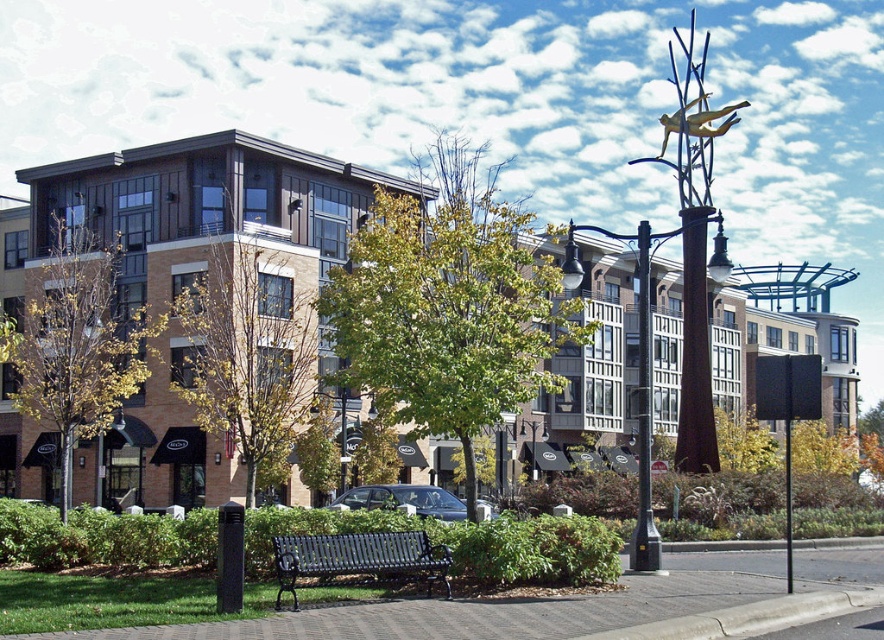
You are standing at the entrance of the building and want to sit on the black metal bench. Which direction should you walk relative to the bronze textured pole at center to reach the bench?

The bronze textured pole at center is located at point (682, 358), so you should walk towards the direction opposite to the bronze textured pole to reach the bench.

You are standing in the urban scene and want to sit on the black metal bench at center. If you face the bronze textured pole at center, which direction should you turn to approach the bench?

The bronze textured pole at center is to the right of the black metal bench at center. So, if you face the pole, you should turn to your left to approach the bench.